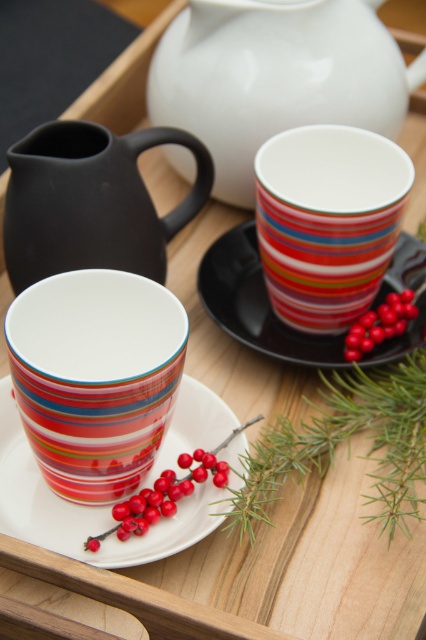
Is matte ceramic mug at center thinner than glossy red berries at center right?

Incorrect, matte ceramic mug at center's width is not less than glossy red berries at center right's.

Does matte ceramic mug at center have a greater width compared to glossy red berries at center right?

Correct, the width of matte ceramic mug at center exceeds that of glossy red berries at center right.

Between point (100, 387) and point (397, 317), which one is positioned behind?

The point (397, 317) is behind.

This screenshot has height=640, width=426. Find the location of `matte ceramic mug at center`. matte ceramic mug at center is located at coordinates (x=95, y=378).

Is point (319, 364) positioned before point (175, 500)?

No.

Is black glossy saucer at center positioned behind smooth glossy berries at center?

Yes, it is behind smooth glossy berries at center.

This screenshot has width=426, height=640. What do you see at coordinates (256, 304) in the screenshot? I see `black glossy saucer at center` at bounding box center [256, 304].

You are a GUI agent. You are given a task and a screenshot of the screen. Output one action in this format:
    pyautogui.click(x=<x>, y=<y>)
    Task: Click on the black glossy saucer at center
    This screenshot has width=426, height=640.
    Given the screenshot: What is the action you would take?
    pyautogui.click(x=256, y=304)

Is point (224, 38) farther from viewer compared to point (134, 536)?

Yes, it is.

Is white glossy teapot at upper center positioned behind white ceramic plate at center?

Yes, white glossy teapot at upper center is behind white ceramic plate at center.

Is point (170, 122) closer to camera compared to point (218, 492)?

No, (170, 122) is behind (218, 492).

The width and height of the screenshot is (426, 640). In order to click on white glossy teapot at upper center in this screenshot , I will do `click(276, 76)`.